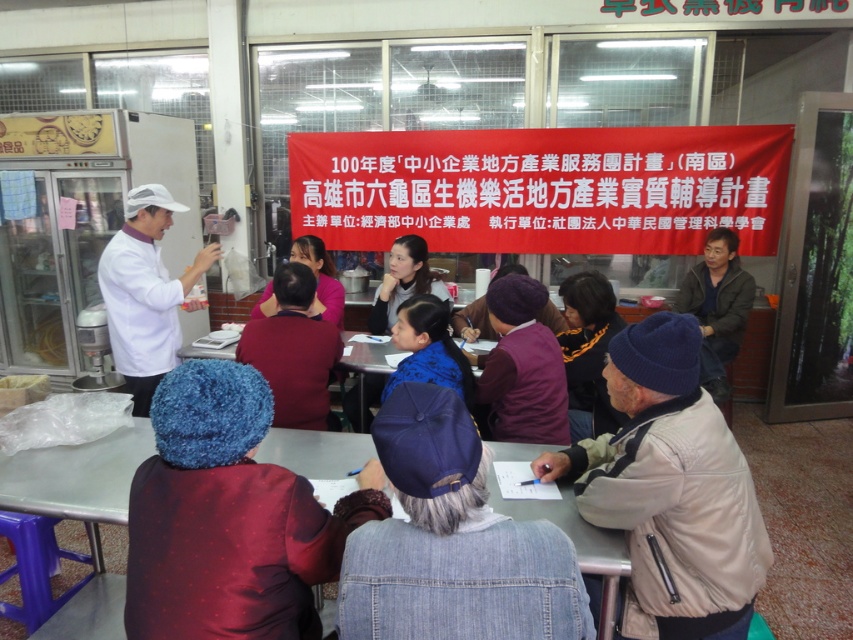
Question: Considering the real-world distances, which object is closest to the white lab coat at left?

Choices:
 (A) dark brown leather jacket at right
 (B) blue fabric scarf at center

Answer: (B)

Question: Is dark brown leather jacket at right below matte black jacket at upper center?

Choices:
 (A) no
 (B) yes

Answer: (A)

Question: Which point is closer to the camera?

Choices:
 (A) yellow-orange fabric headscarf at center
 (B) blue fabric scarf at center

Answer: (B)

Question: Which object is closer to the camera taking this photo?

Choices:
 (A) purple woolen hat at center
 (B) matte black jacket at upper center
 (C) white lab coat at left

Answer: (A)

Question: Can you confirm if purple woolen hat at center is positioned below pink fabric shirt at center?

Choices:
 (A) yes
 (B) no

Answer: (A)

Question: Does fuzzy blue hat at center appear under purple denim jacket at center?

Choices:
 (A) no
 (B) yes

Answer: (B)